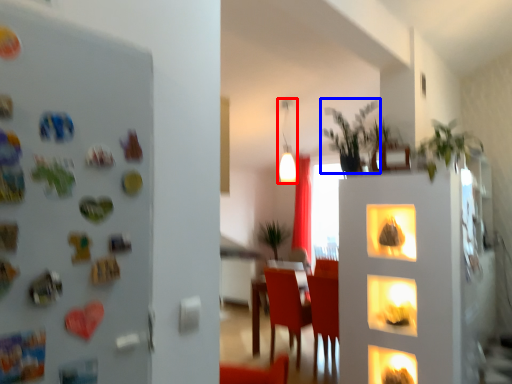
Question: Among these objects, which one is farthest to the camera, lamp (highlighted by a red box) or plant (highlighted by a blue box)?

Choices:
 (A) lamp
 (B) plant

Answer: (A)